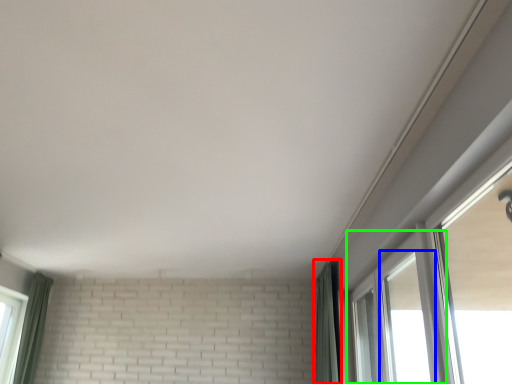
Question: Based on their relative distances, which object is nearer to curtain (highlighted by a red box)? Choose from window (highlighted by a blue box) and window (highlighted by a green box).

Choices:
 (A) window
 (B) window

Answer: (B)